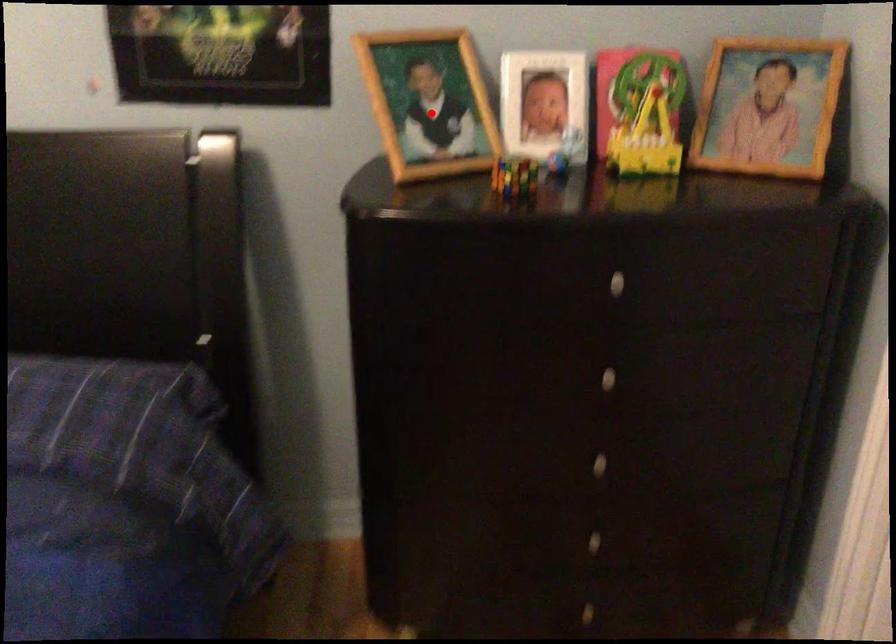
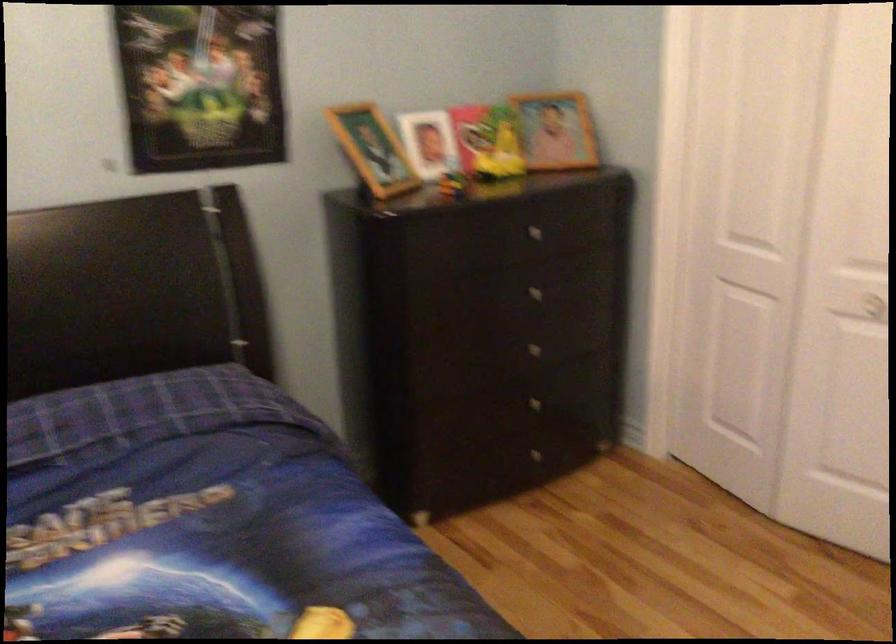
Find the pixel in the second image that matches the highlighted location in the first image.

(373, 149)